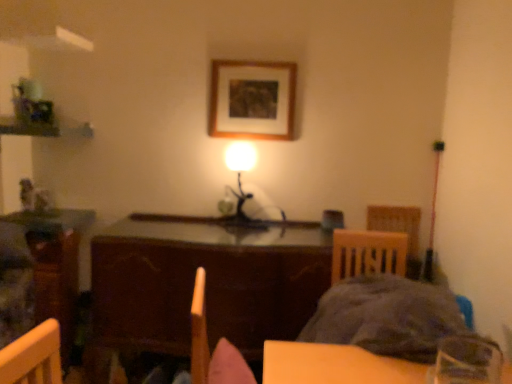
Question: Is point (359, 319) positioned closer to the camera than point (231, 59)?

Choices:
 (A) farther
 (B) closer

Answer: (B)

Question: Is fluffy gray blanket at lower right taller or shorter than wooden picture frame at upper center?

Choices:
 (A) tall
 (B) short

Answer: (B)

Question: Considering the real-world distances, which object is farthest from the wooden picture frame at upper center?

Choices:
 (A) fluffy gray blanket at lower right
 (B) metallic silver table lamp at center
 (C) wooden table at left, the second table viewed from the right
 (D) wooden table at center, which is the first table from right to left
 (E) matte brown armchair at center

Answer: (A)

Question: Which object is the farthest from the wooden table at center, which is the first table from right to left?

Choices:
 (A) wooden table at left, which is counted as the first table, starting from the left
 (B) matte brown armchair at center
 (C) fluffy gray blanket at lower right
 (D) wooden picture frame at upper center
 (E) metallic silver table lamp at center

Answer: (D)